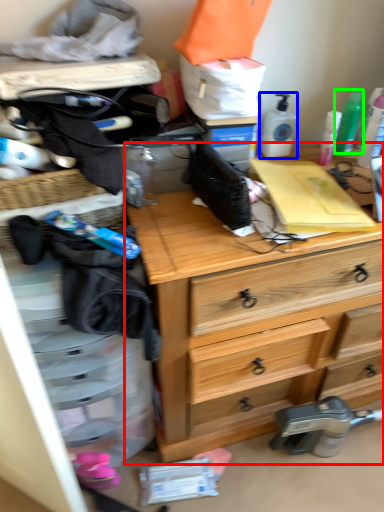
Question: Estimate the real-world distances between objects in this image. Which object is closer to chest of drawers (highlighted by a red box), toiletry (highlighted by a blue box) or toiletry (highlighted by a green box)?

Choices:
 (A) toiletry
 (B) toiletry

Answer: (A)